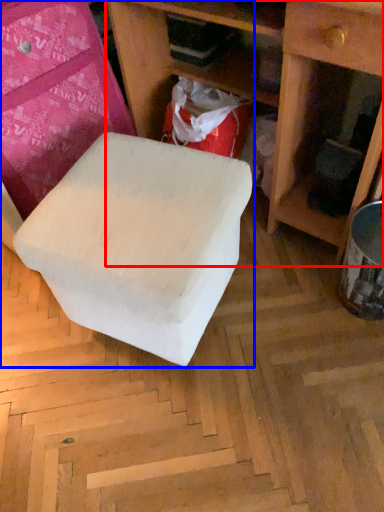
Question: Which of the following is the farthest to the observer, shelf (highlighted by a red box) or furniture (highlighted by a blue box)?

Choices:
 (A) shelf
 (B) furniture

Answer: (B)